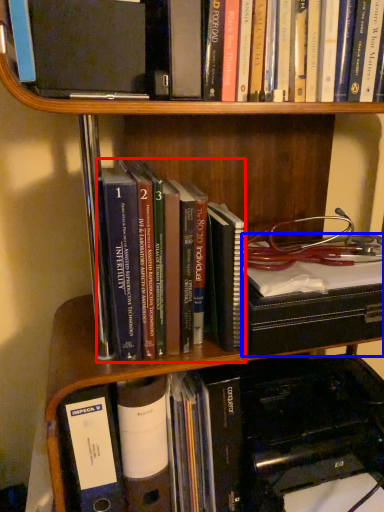
Question: Which object appears closest to the camera in this image, book (highlighted by a red box) or book (highlighted by a blue box)?

Choices:
 (A) book
 (B) book

Answer: (A)